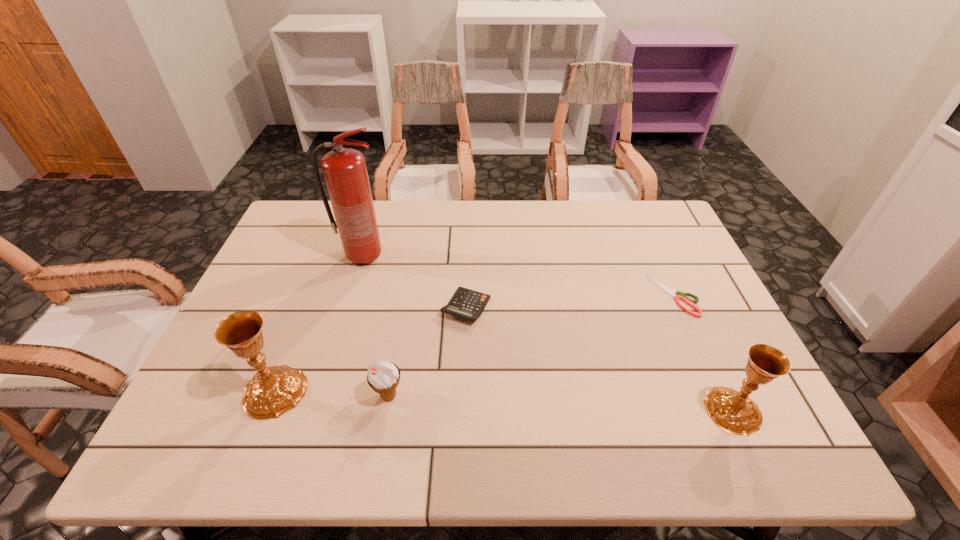
Identify the location of free space between the icecream and the right chalice. This screenshot has width=960, height=540. (561, 403).

You are a GUI agent. You are given a task and a screenshot of the screen. Output one action in this format:
    pyautogui.click(x=<x>, y=<y>)
    Task: Click on the vacant region between the fourth tallest object and the second shortest object
    
    Given the screenshot: What is the action you would take?
    pyautogui.click(x=427, y=352)

Identify the location of free space between the fifth shortest object and the tallest object. (319, 324).

Identify the location of vacant region between the scissors and the icecream. tap(532, 346).

You are a GUI agent. You are given a task and a screenshot of the screen. Output one action in this format:
    pyautogui.click(x=<x>, y=<y>)
    Task: Click on the free area in between the second shortest object and the farthest object
    The width and height of the screenshot is (960, 540).
    Given the screenshot: What is the action you would take?
    pyautogui.click(x=415, y=282)

Locate an element on the screen. The width and height of the screenshot is (960, 540). free spot between the tallest object and the calculator is located at coordinates (415, 282).

In order to click on free space between the right chalice and the second tallest object in this screenshot , I will do `click(504, 401)`.

In order to click on the fourth closest object to the fourth object from left to right in this screenshot , I will do `click(680, 295)`.

Identify the location of object identified as the fourth closest to the calculator. (680, 295).

Image resolution: width=960 pixels, height=540 pixels. In order to click on free region that satisfies the following two spatial constraints: 1. on the handle side the farthest object; 2. on the back side of the third object from right to left in this screenshot , I will do `click(348, 307)`.